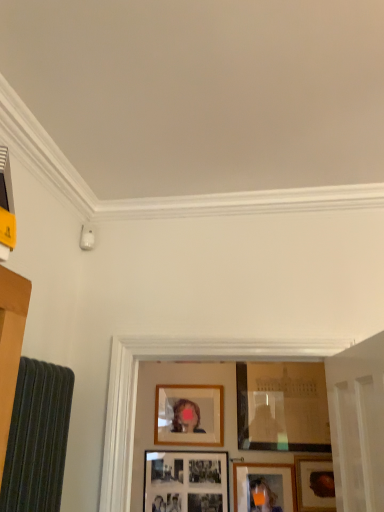
Question: Which direction should I rotate to look at matte wooden picture frame at lower center, the third picture frame when ordered from right to left, — up or down?

Choices:
 (A) down
 (B) up

Answer: (A)

Question: Is matte black picture frame at lower center, the fifth picture frame from the right, inside wooden frame at lower right, which is the 5th picture frame in left-to-right order?

Choices:
 (A) no
 (B) yes

Answer: (A)

Question: Considering the relative positions of wooden frame at lower right, which is the 5th picture frame in left-to-right order, and matte black picture frame at lower center, the fifth picture frame from the right, in the image provided, is wooden frame at lower right, which is the 5th picture frame in left-to-right order, to the right of matte black picture frame at lower center, the fifth picture frame from the right, from the viewer's perspective?

Choices:
 (A) no
 (B) yes

Answer: (B)

Question: Could you tell me if wooden frame at lower right, which is the 5th picture frame in left-to-right order, is facing matte black picture frame at lower center, which is the 1th picture frame in left-to-right order?

Choices:
 (A) no
 (B) yes

Answer: (A)

Question: Is wooden frame at lower right, acting as the first picture frame starting from the right, positioned with its back to matte black picture frame at lower center, which is the 1th picture frame in left-to-right order?

Choices:
 (A) no
 (B) yes

Answer: (A)

Question: Can you confirm if wooden frame at lower right, which is the 5th picture frame in left-to-right order, is thinner than matte black picture frame at lower center, the fifth picture frame from the right?

Choices:
 (A) yes
 (B) no

Answer: (B)

Question: Is wooden frame at lower right, which is the 5th picture frame in left-to-right order, next to matte black picture frame at lower center, which is the 1th picture frame in left-to-right order, and touching it?

Choices:
 (A) no
 (B) yes

Answer: (A)

Question: Can you confirm if wooden picture frame at center, positioned as the second picture frame in left-to-right order, is smaller than matte black picture frame at lower center, which is the 1th picture frame in left-to-right order?

Choices:
 (A) yes
 (B) no

Answer: (B)

Question: Is wooden picture frame at center, the fourth picture frame positioned from the right, turned away from matte black picture frame at lower center, the fifth picture frame from the right?

Choices:
 (A) no
 (B) yes

Answer: (A)

Question: Is wooden picture frame at center, the fourth picture frame positioned from the right, next to matte black picture frame at lower center, which is the 1th picture frame in left-to-right order, and touching it?

Choices:
 (A) yes
 (B) no

Answer: (B)

Question: Is wooden picture frame at center, positioned as the second picture frame in left-to-right order, to the right of matte black picture frame at lower center, the fifth picture frame from the right, from the viewer's perspective?

Choices:
 (A) yes
 (B) no

Answer: (A)

Question: Considering the relative sizes of wooden picture frame at center, the fourth picture frame positioned from the right, and matte black picture frame at lower center, which is the 1th picture frame in left-to-right order, in the image provided, is wooden picture frame at center, the fourth picture frame positioned from the right, taller than matte black picture frame at lower center, which is the 1th picture frame in left-to-right order,?

Choices:
 (A) yes
 (B) no

Answer: (A)

Question: Is wooden picture frame at center, positioned as the second picture frame in left-to-right order, located outside matte black picture frame at lower center, the fifth picture frame from the right?

Choices:
 (A) yes
 (B) no

Answer: (A)

Question: From a real-world perspective, is matte glass picture frame at center, acting as the 4th picture frame starting from the left, located higher than matte wooden picture frame at lower center, the third picture frame when ordered from right to left?

Choices:
 (A) no
 (B) yes

Answer: (B)